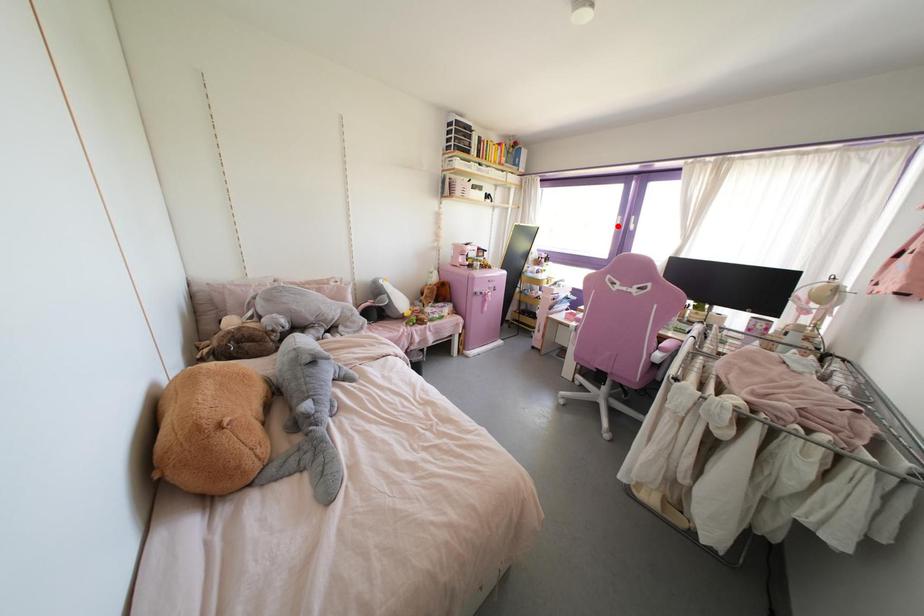
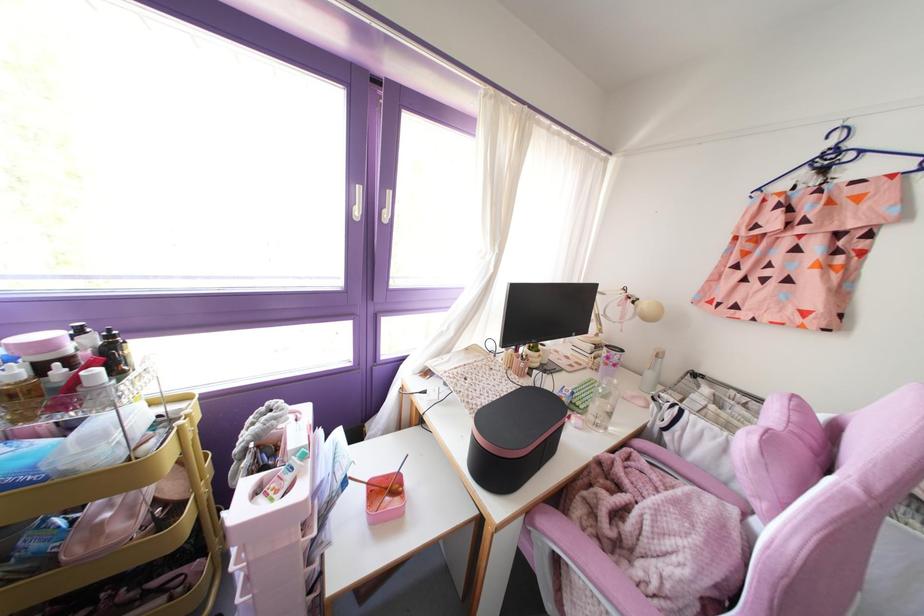
Question: I am providing you with two images of the same scene from different viewpoints. A red point is shown in image1. For the corresponding object point in image2, is it positioned nearer or farther from the camera?

Choices:
 (A) Nearer
 (B) Farther

Answer: (B)